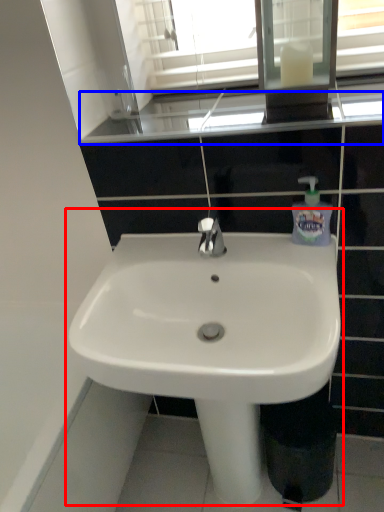
Question: Which object is closer to the camera taking this photo, sink (highlighted by a red box) or window sill (highlighted by a blue box)?

Choices:
 (A) sink
 (B) window sill

Answer: (A)